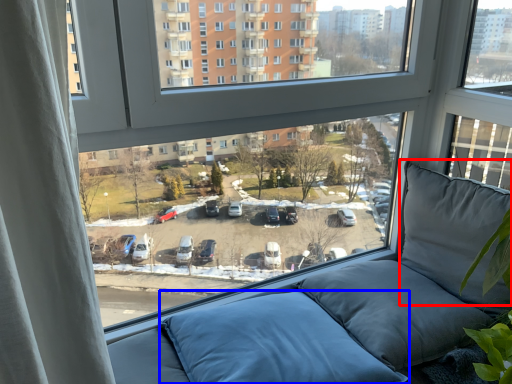
Question: Which point is further to the camera, pillow (highlighted by a red box) or pillow (highlighted by a blue box)?

Choices:
 (A) pillow
 (B) pillow

Answer: (A)